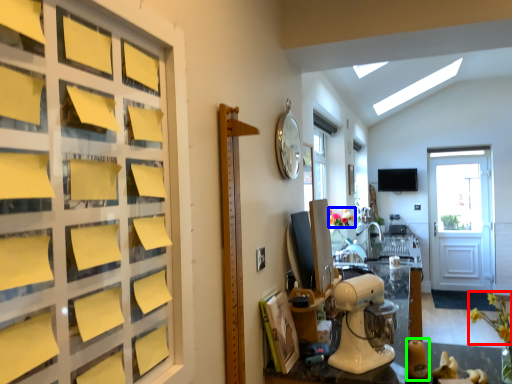
Question: Estimate the real-world distances between objects in this image. Which object is closer to flower (highlighted by a red box), flower (highlighted by a blue box) or toy (highlighted by a green box)?

Choices:
 (A) flower
 (B) toy

Answer: (B)